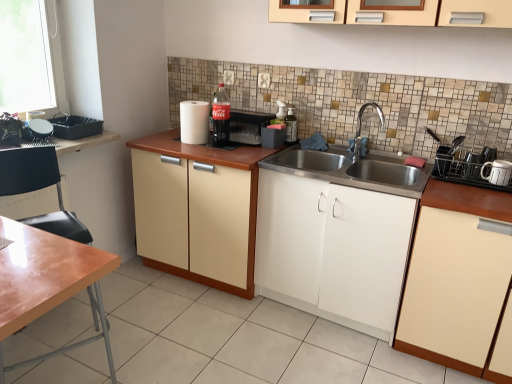
Question: From the image's perspective, is white ceramic mug at right, marked as the sixth appliance in a left-to-right arrangement, beneath white paper towel at center, arranged as the fifth appliance when viewed from the right?

Choices:
 (A) yes
 (B) no

Answer: (A)

Question: Is white ceramic mug at right, marked as the sixth appliance in a left-to-right arrangement, in contact with white paper towel at center, arranged as the fifth appliance when viewed from the right?

Choices:
 (A) yes
 (B) no

Answer: (B)

Question: Can you confirm if white ceramic mug at right, marked as the sixth appliance in a left-to-right arrangement, is thinner than white paper towel at center, arranged as the fifth appliance when viewed from the right?

Choices:
 (A) no
 (B) yes

Answer: (B)

Question: From a real-world perspective, is white ceramic mug at right, the first appliance when ordered from right to left, over white paper towel at center, which is the second appliance in left-to-right order?

Choices:
 (A) no
 (B) yes

Answer: (A)

Question: Is white ceramic mug at right, the first appliance when ordered from right to left, in front of white paper towel at center, which is the second appliance in left-to-right order?

Choices:
 (A) yes
 (B) no

Answer: (A)

Question: From the image's perspective, is white ceramic mug at right, marked as the sixth appliance in a left-to-right arrangement, on top of white paper towel at center, which is the second appliance in left-to-right order?

Choices:
 (A) yes
 (B) no

Answer: (B)

Question: Can you confirm if wooden tray at left is smaller than white ceramic mug at right, marked as the sixth appliance in a left-to-right arrangement?

Choices:
 (A) no
 (B) yes

Answer: (A)

Question: From a real-world perspective, is wooden tray at left below white ceramic mug at right, marked as the sixth appliance in a left-to-right arrangement?

Choices:
 (A) no
 (B) yes

Answer: (B)

Question: Is wooden tray at left positioned behind white ceramic mug at right, the first appliance when ordered from right to left?

Choices:
 (A) yes
 (B) no

Answer: (A)

Question: Is wooden tray at left positioned with its back to white ceramic mug at right, the first appliance when ordered from right to left?

Choices:
 (A) yes
 (B) no

Answer: (B)

Question: Is wooden tray at left far away from white ceramic mug at right, the first appliance when ordered from right to left?

Choices:
 (A) yes
 (B) no

Answer: (A)

Question: From the image's perspective, is wooden tray at left located above white ceramic mug at right, the first appliance when ordered from right to left?

Choices:
 (A) yes
 (B) no

Answer: (A)

Question: Is silver metallic faucet at center inside matte plastic soda machine at center, positioned as the fourth appliance in right-to-left order?

Choices:
 (A) no
 (B) yes

Answer: (A)